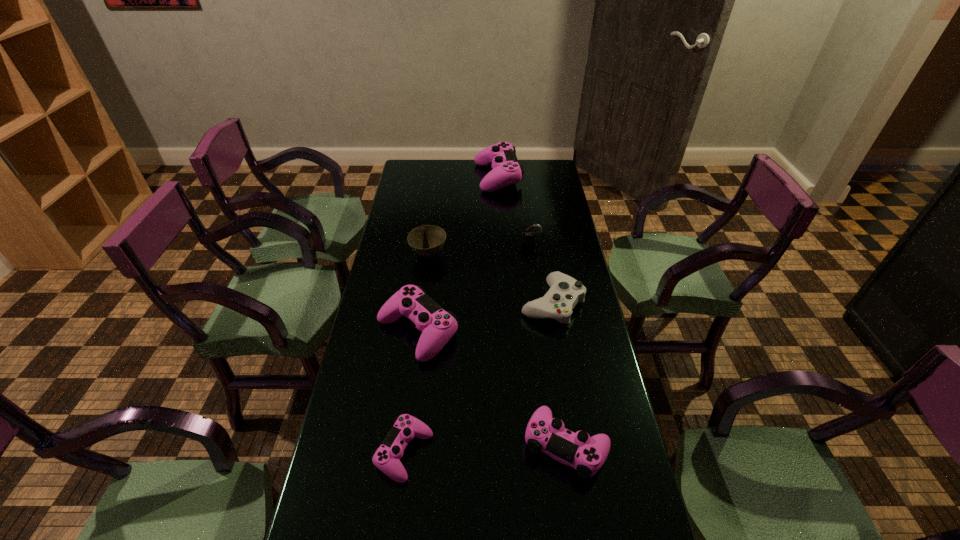
Image resolution: width=960 pixels, height=540 pixels. In order to click on vacant space at the far edge in this screenshot , I will do `click(469, 160)`.

In the image, there is a desktop. At what (x,y) coordinates should I click in order to perform the action: click on vacant space at the left edge. Please return your answer as a coordinate pair (x, y). The image size is (960, 540). Looking at the image, I should click on (400, 206).

The image size is (960, 540). In order to click on vacant space at the right edge of the desktop in this screenshot , I will do `click(566, 268)`.

Find the location of a particular element. free region at the far left corner is located at coordinates (404, 168).

This screenshot has width=960, height=540. In order to click on free space that is in between the tallest object and the padlock in this screenshot , I will do `click(515, 211)`.

The height and width of the screenshot is (540, 960). I want to click on vacant area that lies between the white control and the padlock, so click(541, 274).

This screenshot has width=960, height=540. I want to click on vacant space in between the bowl and the third biggest pink control, so click(497, 350).

Identify which object is the sixth nearest to the white control. Please provide its 2D coordinates. Your answer should be formatted as a tuple, i.e. [(x, y)], where the tuple contains the x and y coordinates of a point satisfying the conditions above.

[(506, 170)]

Point out which object is positioned as the fifth nearest to the white control. Please provide its 2D coordinates. Your answer should be formatted as a tuple, i.e. [(x, y)], where the tuple contains the x and y coordinates of a point satisfying the conditions above.

[(386, 458)]

Point out which control is positioned as the fourth nearest to the farthest control. Please provide its 2D coordinates. Your answer should be formatted as a tuple, i.e. [(x, y)], where the tuple contains the x and y coordinates of a point satisfying the conditions above.

[(386, 458)]